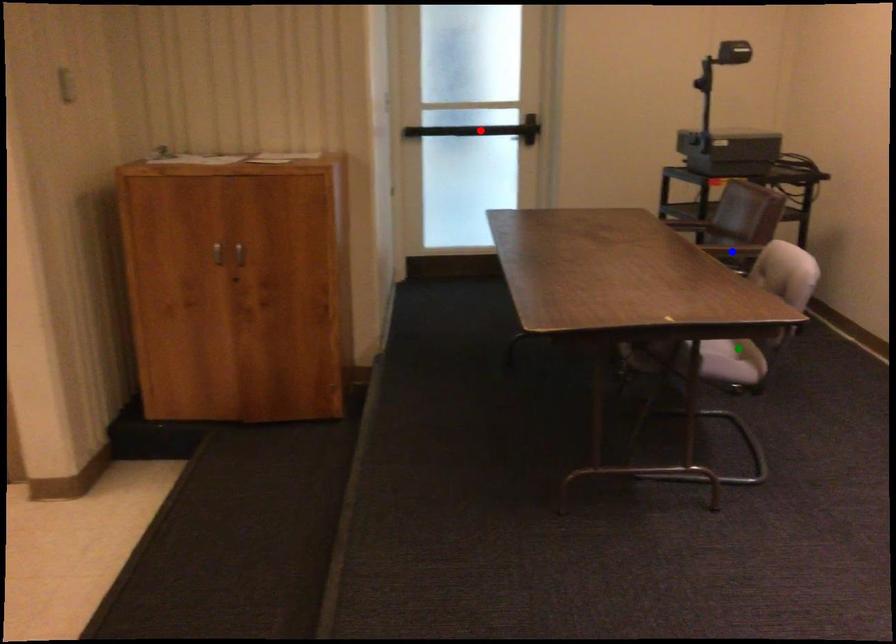
Order these from farthest to nearest:
green point | red point | blue point

red point < blue point < green point